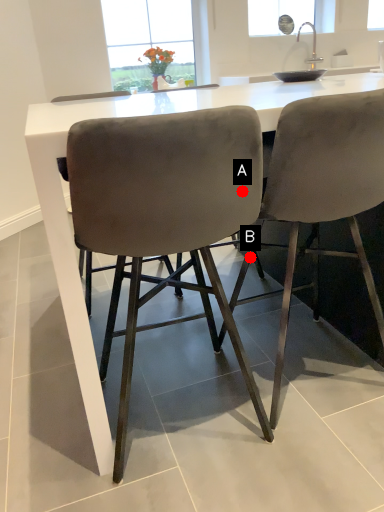
Question: Two points are circled on the image, labeled by A and B beside each circle. Which of the following is the farthest from the observer?

Choices:
 (A) A is further
 (B) B is further

Answer: (B)